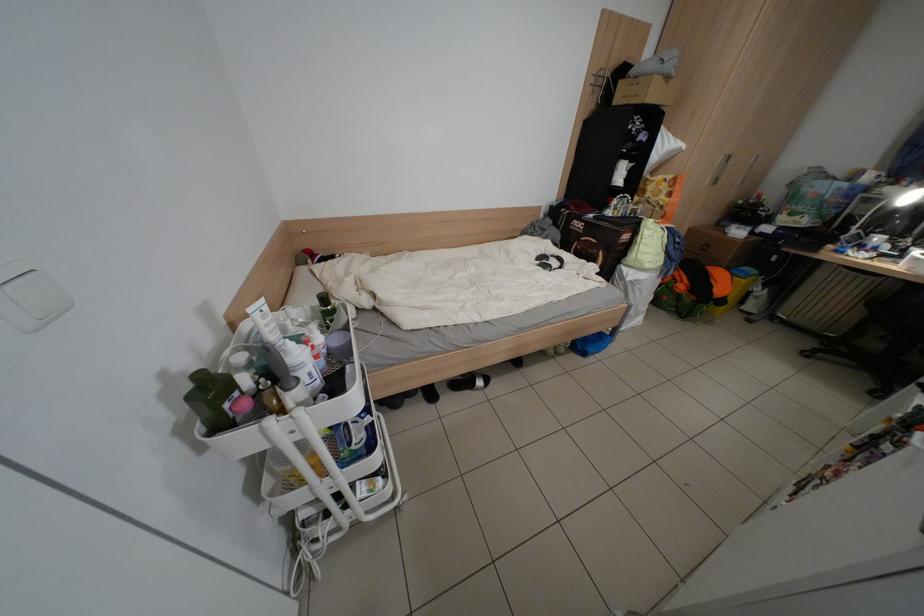
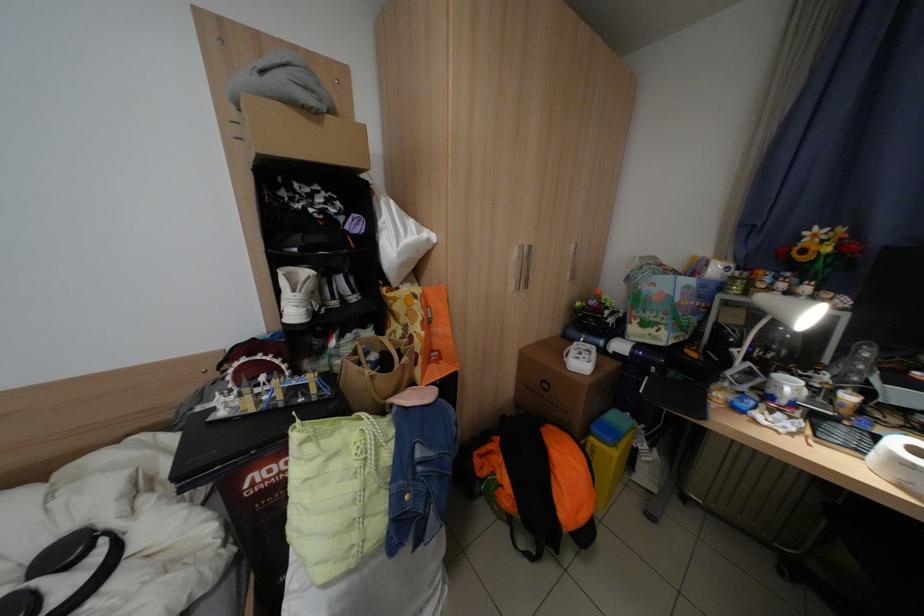
In the second image, find the point that corresponds to point 891,240 in the first image.

(800, 387)